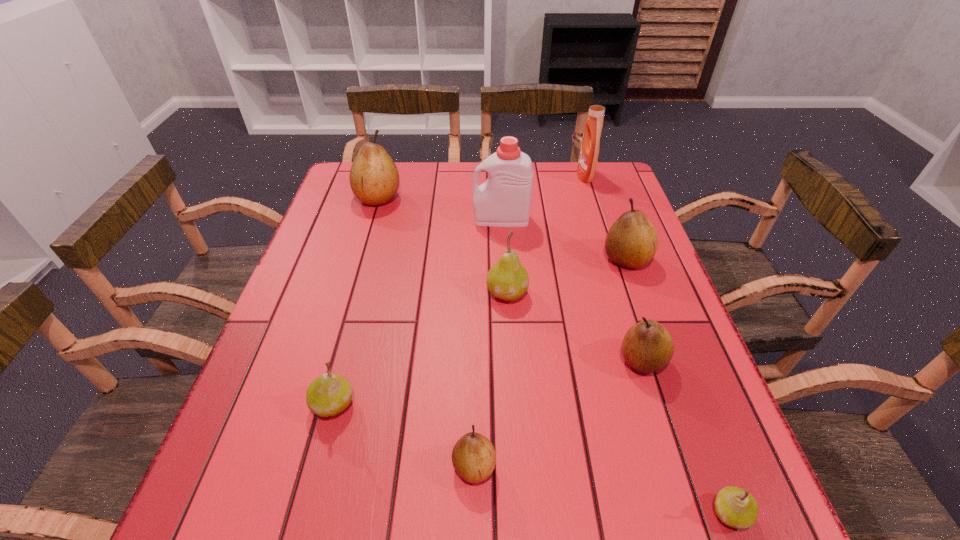
The height and width of the screenshot is (540, 960). What are the coordinates of `free space between the third nearest pear and the farthest brown pear` in the screenshot? It's located at (356, 301).

Where is `free point between the seventh farthest object and the nearest object`? This screenshot has height=540, width=960. free point between the seventh farthest object and the nearest object is located at coordinates (532, 458).

At what (x,y) coordinates should I click in order to perform the action: click on blank region between the fifth nearest pear and the leftmost brown pear. Please return your answer as a coordinate pair (x, y). Looking at the image, I should click on (443, 245).

This screenshot has width=960, height=540. I want to click on vacant area that lies between the smallest green pear and the biggest brown pear, so click(x=554, y=355).

The width and height of the screenshot is (960, 540). I want to click on vacant area that lies between the nearest brown pear and the farthest green pear, so click(x=491, y=379).

This screenshot has width=960, height=540. Identify the location of vacant area that lies between the farthest pear and the third farthest pear. (443, 245).

Where is `blank region between the biggest green pear and the third nearest brown pear`? The image size is (960, 540). blank region between the biggest green pear and the third nearest brown pear is located at coordinates 566,275.

The height and width of the screenshot is (540, 960). Identify the location of vacant space that is in between the farthest pear and the fifth farthest object. (x=443, y=245).

At what (x,y) coordinates should I click in order to perform the action: click on free space between the fifth nearest pear and the sixth farthest pear. Please return your answer as a coordinate pair (x, y). The image size is (960, 540). Looking at the image, I should click on (491, 379).

This screenshot has height=540, width=960. What are the coordinates of `object that is the closest one to the smallest green pear` in the screenshot? It's located at (647, 347).